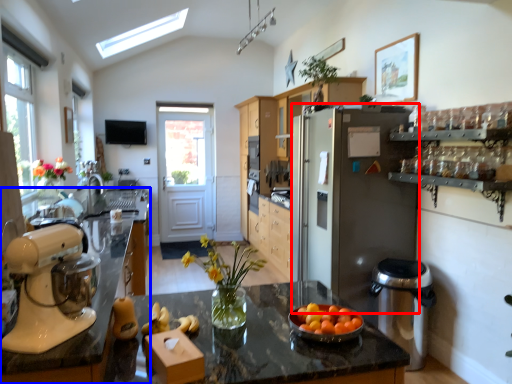
Question: Which of the following is the closest to the observer, refrigerator (highlighted by a red box) or countertop (highlighted by a blue box)?

Choices:
 (A) refrigerator
 (B) countertop

Answer: (B)